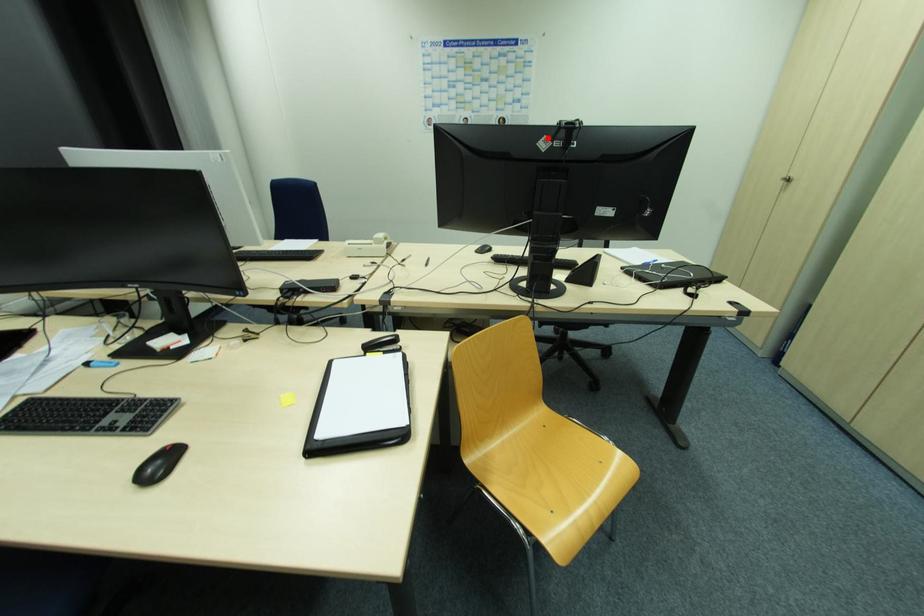
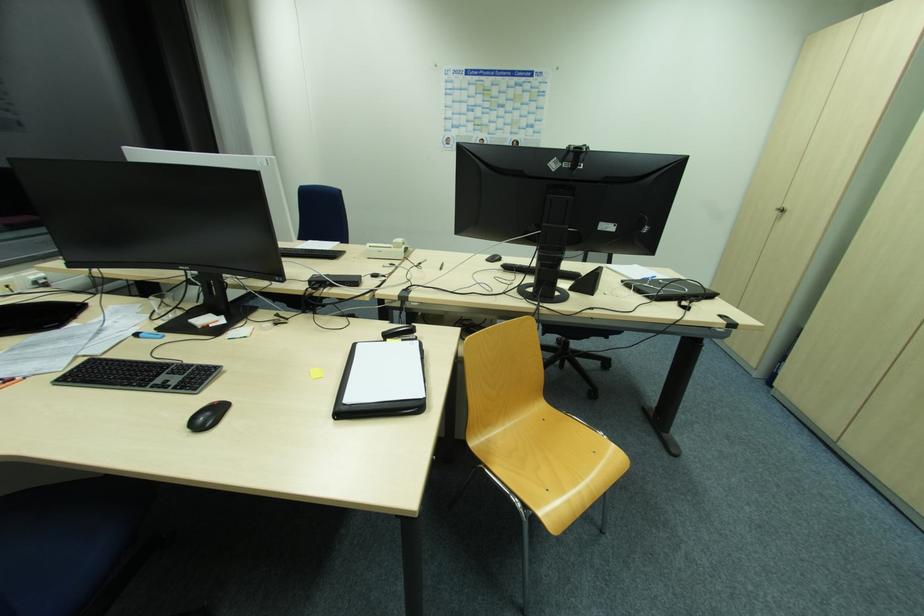
Where in the second image is the point corresponding to the highlighted location from the first image?

(557, 159)